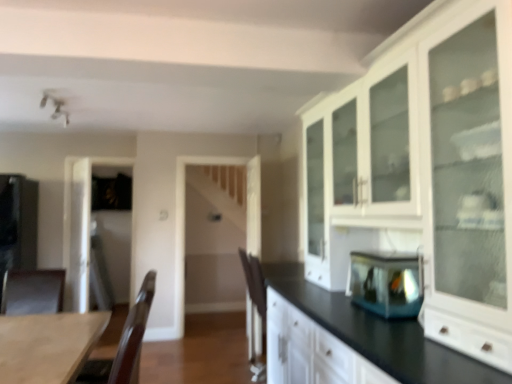
Question: From the image's perspective, would you say brown wood armchair at left, the first armchair positioned from the right, is positioned over wooden table at lower left?

Choices:
 (A) no
 (B) yes

Answer: (A)

Question: Is wooden table at lower left completely or partially inside brown wood armchair at left, the first armchair positioned from the right?

Choices:
 (A) yes
 (B) no

Answer: (B)

Question: From a real-world perspective, does brown wood armchair at left, positioned as the second armchair in left-to-right order, sit lower than wooden table at lower left?

Choices:
 (A) no
 (B) yes

Answer: (B)

Question: From the image's perspective, is brown wood armchair at left, positioned as the second armchair in left-to-right order, under wooden table at lower left?

Choices:
 (A) no
 (B) yes

Answer: (B)

Question: Does brown wood armchair at left, the first armchair positioned from the right, have a lesser height compared to wooden table at lower left?

Choices:
 (A) no
 (B) yes

Answer: (A)

Question: Does brown wood armchair at left, the first armchair positioned from the right, lie behind wooden table at lower left?

Choices:
 (A) yes
 (B) no

Answer: (A)

Question: Is brown leather armchair at lower left, the 1th armchair in the left-to-right sequence, not near transparent glass door at left?

Choices:
 (A) yes
 (B) no

Answer: (A)

Question: Are brown leather armchair at lower left, marked as the second armchair in a right-to-left arrangement, and transparent glass door at left making contact?

Choices:
 (A) no
 (B) yes

Answer: (A)

Question: Is brown leather armchair at lower left, marked as the second armchair in a right-to-left arrangement, shorter than transparent glass door at left?

Choices:
 (A) yes
 (B) no

Answer: (A)

Question: Is brown leather armchair at lower left, the 1th armchair in the left-to-right sequence, thinner than transparent glass door at left?

Choices:
 (A) no
 (B) yes

Answer: (A)

Question: Would you say transparent glass door at left is part of brown leather armchair at lower left, marked as the second armchair in a right-to-left arrangement,'s contents?

Choices:
 (A) no
 (B) yes

Answer: (A)

Question: Is brown leather armchair at lower left, the 1th armchair in the left-to-right sequence, to the right of transparent glass door at left from the viewer's perspective?

Choices:
 (A) yes
 (B) no

Answer: (A)

Question: Considering the relative positions of brown leather armchair at lower left, marked as the second armchair in a right-to-left arrangement, and white glossy cabinet at upper right in the image provided, is brown leather armchair at lower left, marked as the second armchair in a right-to-left arrangement, in front of white glossy cabinet at upper right?

Choices:
 (A) no
 (B) yes

Answer: (A)